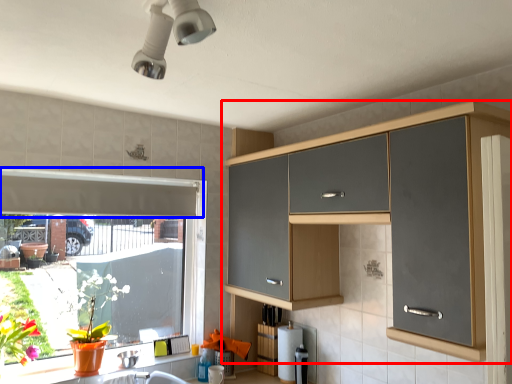
Question: Which object is further to the camera taking this photo, cabinetry (highlighted by a red box) or exhaust hood (highlighted by a blue box)?

Choices:
 (A) cabinetry
 (B) exhaust hood

Answer: (B)